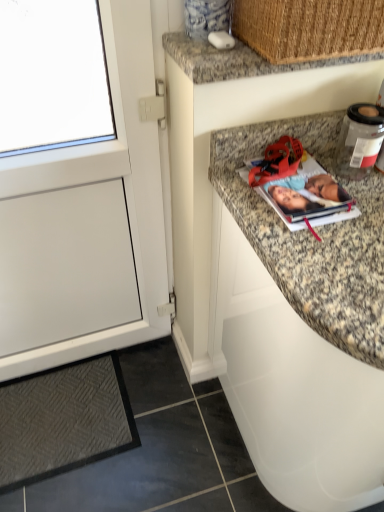
Where is `woven straw basket at upper right`? This screenshot has height=512, width=384. woven straw basket at upper right is located at coordinates (309, 28).

This screenshot has height=512, width=384. Find the location of `matte paper photo album at upper right`. matte paper photo album at upper right is located at coordinates (308, 197).

This screenshot has height=512, width=384. I want to click on granite countertop at upper center, so click(236, 59).

The width and height of the screenshot is (384, 512). What do you see at coordinates (359, 140) in the screenshot?
I see `clear plastic bottle at upper right` at bounding box center [359, 140].

This screenshot has height=512, width=384. What do you see at coordinates (63, 420) in the screenshot?
I see `dark gray textured mat at lower left` at bounding box center [63, 420].

Where is `white matte cabinet at left, which is counted as the 2th cabinetry, starting from the right`? white matte cabinet at left, which is counted as the 2th cabinetry, starting from the right is located at coordinates (88, 225).

From the image's perspective, between white matte cabinet at left, which is counted as the 2th cabinetry, starting from the right, and woven straw basket at upper right, who is located below?

white matte cabinet at left, which is counted as the 2th cabinetry, starting from the right, is shown below in the image.

Can you tell me how much white matte cabinet at left, the 1th cabinetry when ordered from left to right, and woven straw basket at upper right differ in facing direction?

The angle between the facing direction of white matte cabinet at left, the 1th cabinetry when ordered from left to right, and the facing direction of woven straw basket at upper right is 1.32 degrees.

Which is behind, point (117, 91) or point (383, 19)?

The point (117, 91) is farther.

From a real-world perspective, starting from the woven straw basket at upper right, which cabinetry is the 1st one below it? Please provide its 2D coordinates.

[(88, 225)]

Locate an element on the screen. Image resolution: width=384 pixels, height=512 pixels. magazine behind the granite countertop at upper center is located at coordinates (308, 197).

Looking at this image, between matte paper photo album at upper right and granite countertop at upper center, which one is positioned behind?

matte paper photo album at upper right.

From the image's perspective, would you say matte paper photo album at upper right is positioned over granite countertop at upper center?

No.

From a real-world perspective, is matte paper photo album at upper right physically located above or below granite countertop at upper center?

In terms of real-world spatial position, matte paper photo album at upper right is below granite countertop at upper center.

You are a GUI agent. You are given a task and a screenshot of the screen. Output one action in this format:
    pyautogui.click(x=<x>, y=<y>)
    Task: Click on the bottle on the right of woven straw basket at upper right
    
    Given the screenshot: What is the action you would take?
    pyautogui.click(x=359, y=140)

Visually, is woven straw basket at upper right positioned to the left or to the right of clear plastic bottle at upper right?

woven straw basket at upper right is to the left of clear plastic bottle at upper right.

Is woven straw basket at upper right next to clear plastic bottle at upper right?

No, woven straw basket at upper right is not with clear plastic bottle at upper right.

Who is taller, woven straw basket at upper right or clear plastic bottle at upper right?

clear plastic bottle at upper right is taller.

From the picture: Is granite countertop at upper center far from granite countertop at upper right, the 2th cabinetry when ordered from left to right?

No.

Considering the sizes of objects granite countertop at upper center and granite countertop at upper right, the 2th cabinetry when ordered from left to right, in the image provided, who is shorter, granite countertop at upper center or granite countertop at upper right, the 2th cabinetry when ordered from left to right,?

With less height is granite countertop at upper center.

The height and width of the screenshot is (512, 384). Find the location of `countertop that is above the granite countertop at upper right, the 2th cabinetry when ordered from left to right (from the image's perspective)`. countertop that is above the granite countertop at upper right, the 2th cabinetry when ordered from left to right (from the image's perspective) is located at coordinates (236, 59).

From the image's perspective, is granite countertop at upper center on granite countertop at upper right, the 2th cabinetry when ordered from left to right?

Yes, from the image's perspective, granite countertop at upper center is on top of granite countertop at upper right, the 2th cabinetry when ordered from left to right.

Between dark gray textured mat at lower left and clear plastic bottle at upper right, which one has smaller width?

clear plastic bottle at upper right.

Is dark gray textured mat at lower left turned away from clear plastic bottle at upper right?

No, dark gray textured mat at lower left's orientation is not away from clear plastic bottle at upper right.

Would you say dark gray textured mat at lower left is outside clear plastic bottle at upper right?

Yes, dark gray textured mat at lower left is not within clear plastic bottle at upper right.

Looking at this image, measure the distance between dark gray textured mat at lower left and clear plastic bottle at upper right.

dark gray textured mat at lower left and clear plastic bottle at upper right are 1.20 meters apart.

Is woven straw basket at upper right facing away from granite countertop at upper right, the 2th cabinetry when ordered from left to right?

No, woven straw basket at upper right is not facing away from granite countertop at upper right, the 2th cabinetry when ordered from left to right.

From the image's perspective, relative to granite countertop at upper right, the first cabinetry positioned from the right, is woven straw basket at upper right above or below?

From the image's perspective, woven straw basket at upper right appears above granite countertop at upper right, the first cabinetry positioned from the right.

Which is more to the left, woven straw basket at upper right or granite countertop at upper right, the 2th cabinetry when ordered from left to right?

Positioned to the left is woven straw basket at upper right.

From the image's perspective, is matte paper photo album at upper right below clear plastic bottle at upper right?

Correct, matte paper photo album at upper right appears lower than clear plastic bottle at upper right in the image.

Is matte paper photo album at upper right smaller than clear plastic bottle at upper right?

Indeed, matte paper photo album at upper right has a smaller size compared to clear plastic bottle at upper right.

Which of these two, matte paper photo album at upper right or clear plastic bottle at upper right, is thinner?

clear plastic bottle at upper right.

From a real-world perspective, starting from the woven straw basket at upper right, which cabinetry is the 1st one below it? Please provide its 2D coordinates.

[(88, 225)]

This screenshot has height=512, width=384. I want to click on countertop on the left of the matte paper photo album at upper right, so click(236, 59).

From the image, which object appears to be farther from clear plastic bottle at upper right, matte paper photo album at upper right or granite countertop at upper center?

Among the two, granite countertop at upper center is located further to clear plastic bottle at upper right.

Based on their spatial positions, is dark gray textured mat at lower left or woven straw basket at upper right closer to granite countertop at upper right, the 2th cabinetry when ordered from left to right?

woven straw basket at upper right.

Estimate the real-world distances between objects in this image. Which object is further from woven straw basket at upper right, matte paper photo album at upper right or clear plastic bottle at upper right?

matte paper photo album at upper right.

Looking at the image, which one is located further to matte paper photo album at upper right, granite countertop at upper center or clear plastic bottle at upper right?

Among the two, granite countertop at upper center is located further to matte paper photo album at upper right.

From the image, which object appears to be nearer to woven straw basket at upper right, dark gray textured mat at lower left or clear plastic bottle at upper right?

clear plastic bottle at upper right lies closer to woven straw basket at upper right than the other object.

Based on their spatial positions, is granite countertop at upper right, the 2th cabinetry when ordered from left to right, or matte paper photo album at upper right further from granite countertop at upper center?

granite countertop at upper right, the 2th cabinetry when ordered from left to right, is positioned further to the anchor granite countertop at upper center.

Estimate the real-world distances between objects in this image. Which object is further from granite countertop at upper center, clear plastic bottle at upper right or granite countertop at upper right, the first cabinetry positioned from the right?

granite countertop at upper right, the first cabinetry positioned from the right.

Considering their positions, is granite countertop at upper right, the 2th cabinetry when ordered from left to right, positioned closer to white matte cabinet at left, which is counted as the 2th cabinetry, starting from the right, than woven straw basket at upper right?

Based on the image, granite countertop at upper right, the 2th cabinetry when ordered from left to right, appears to be nearer to white matte cabinet at left, which is counted as the 2th cabinetry, starting from the right.

What are the coordinates of `magazine that lies between granite countertop at upper center and granite countertop at upper right, the 2th cabinetry when ordered from left to right, from top to bottom` in the screenshot? It's located at (308, 197).

I want to click on countertop between woven straw basket at upper right and dark gray textured mat at lower left in the vertical direction, so click(x=236, y=59).

The height and width of the screenshot is (512, 384). In order to click on bottle between granite countertop at upper center and granite countertop at upper right, the 2th cabinetry when ordered from left to right, in the vertical direction in this screenshot , I will do `click(359, 140)`.

The height and width of the screenshot is (512, 384). What are the coordinates of `countertop between white matte cabinet at left, which is counted as the 2th cabinetry, starting from the right, and matte paper photo album at upper right` in the screenshot? It's located at (236, 59).